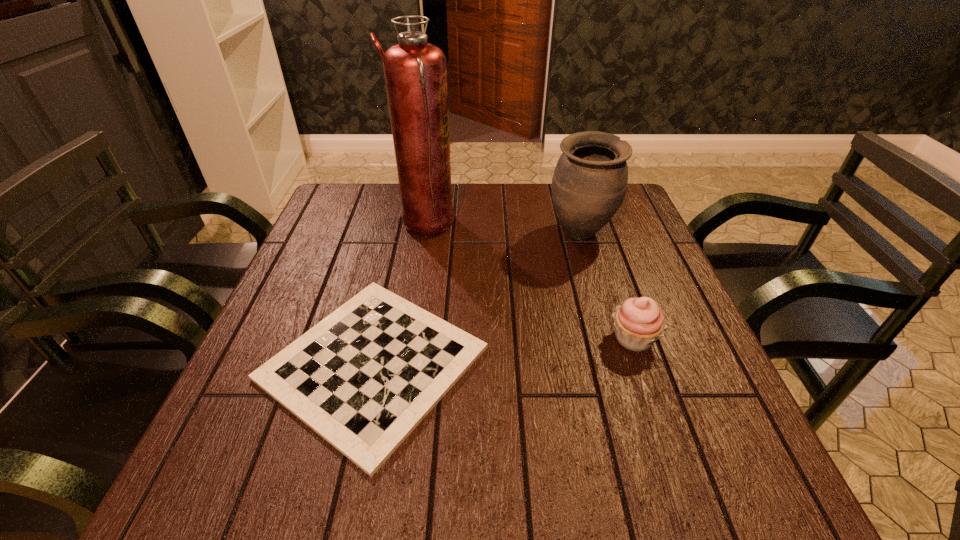
You are a GUI agent. You are given a task and a screenshot of the screen. Output one action in this format:
    pyautogui.click(x=<x>, y=<y>)
    Task: Click on the free space that is in between the checkerboard and the fire extinguisher
    This screenshot has width=960, height=540.
    Given the screenshot: What is the action you would take?
    pyautogui.click(x=399, y=294)

Identify which object is the closest to the fire extinguisher. Please provide its 2D coordinates. Your answer should be formatted as a tuple, i.e. [(x, y)], where the tuple contains the x and y coordinates of a point satisfying the conditions above.

[(363, 378)]

Find the location of a particular element. the second closest object to the cupcake is located at coordinates (363, 378).

This screenshot has width=960, height=540. I want to click on free space that satisfies the following two spatial constraints: 1. on the side of the third shortest object with the label; 2. on the right side of the fire extinguisher, so click(x=423, y=234).

Find the location of a particular element. free space that satisfies the following two spatial constraints: 1. on the side of the tallest object with the label; 2. on the right side of the urn is located at coordinates (423, 234).

Identify the location of free space in the image that satisfies the following two spatial constraints: 1. on the side of the tallest object with the label; 2. on the front side of the checkerboard. (402, 363).

Identify the location of vacant region that satisfies the following two spatial constraints: 1. on the side of the fire extinguisher with the label; 2. on the back side of the third shortest object. The image size is (960, 540). (423, 234).

At what (x,y) coordinates should I click in order to perform the action: click on free location that satisfies the following two spatial constraints: 1. on the back side of the urn; 2. on the left side of the shortest object. Please return your answer as a coordinate pair (x, y). This screenshot has width=960, height=540. Looking at the image, I should click on [x=402, y=234].